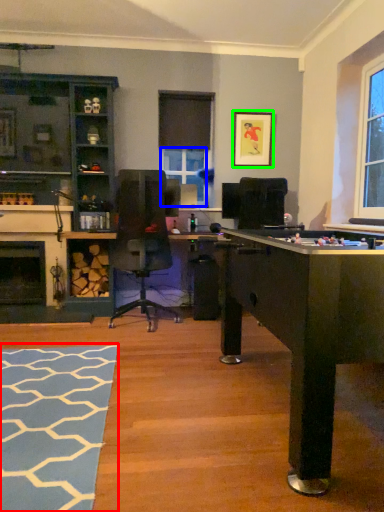
Question: Estimate the real-world distances between objects in this image. Which object is farther from flat (highlighted by a red box), window screen (highlighted by a blue box) or picture frame (highlighted by a green box)?

Choices:
 (A) window screen
 (B) picture frame

Answer: (B)